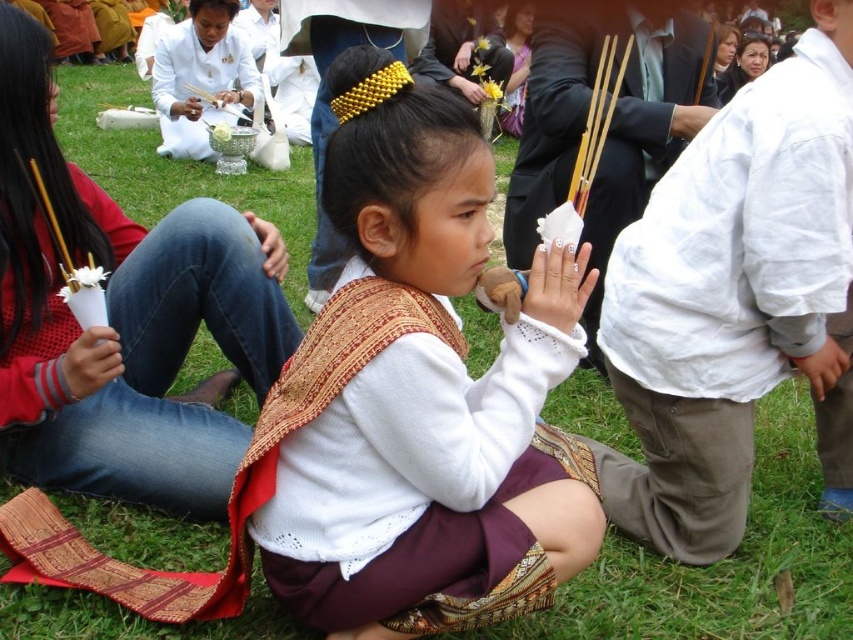
You are a photographer taking a picture of the scene. You want to focus on the point closer to the camera between the two points labeled as point (531, 403) and point (86, 340). Which point should you focus on?

You should focus on point (531, 403) because it is closer to the camera than point (86, 340).

Based on the scene described, which object is positioned to the left of the other between the white cotton shirt at right and the white cotton hand at lower right?

The white cotton shirt at right is positioned to the left of the white cotton hand at lower right.

In the scene, there is a young girl wearing traditional clothing. She has white lace gloves at center and a white fabric hand at center. Which object is positioned to the right side?

The white lace gloves at center are to the right of the white fabric hand at center.